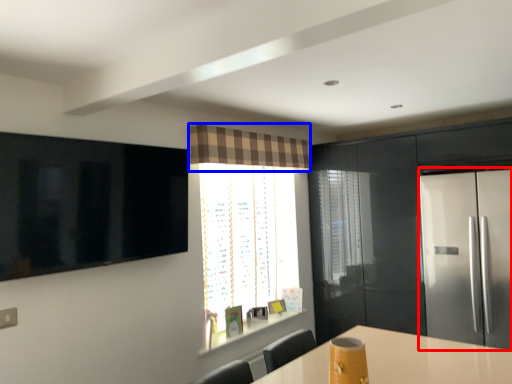
Question: Among these objects, which one is nearest to the camera, fridge (highlighted by a red box) or curtain (highlighted by a blue box)?

Choices:
 (A) fridge
 (B) curtain

Answer: (A)